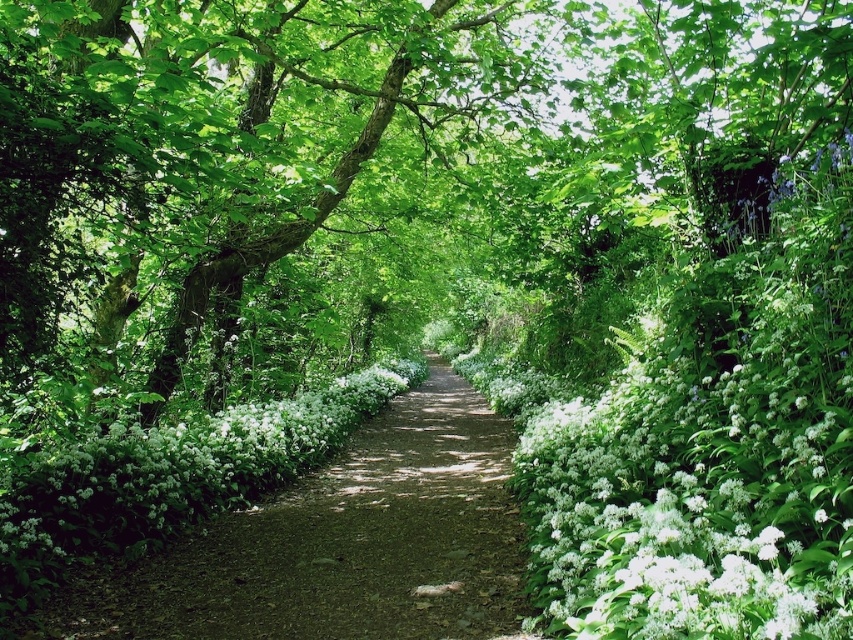
Identify the location of green leafy tree at center. Image resolution: width=853 pixels, height=640 pixels. (212, 161).

Who is positioned more to the left, green leafy tree at center or white matte flowers at center?

green leafy tree at center is more to the left.

Who is more distant from viewer, (241, 93) or (88, 476)?

Positioned behind is point (241, 93).

At what (x,y) coordinates should I click in order to perform the action: click on green leafy tree at center. Please return your answer as a coordinate pair (x, y). Image resolution: width=853 pixels, height=640 pixels. Looking at the image, I should click on (212, 161).